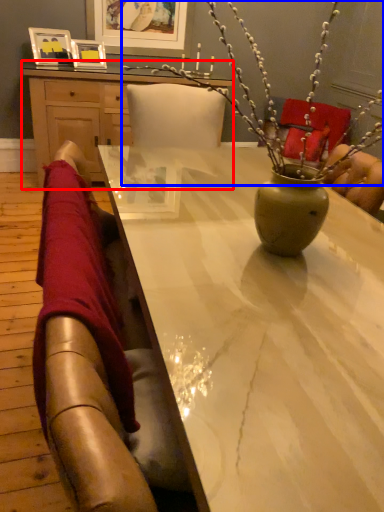
Question: Among these objects, which one is nearest to the camera, desk (highlighted by a red box) or floral arrangement (highlighted by a blue box)?

Choices:
 (A) desk
 (B) floral arrangement

Answer: (B)